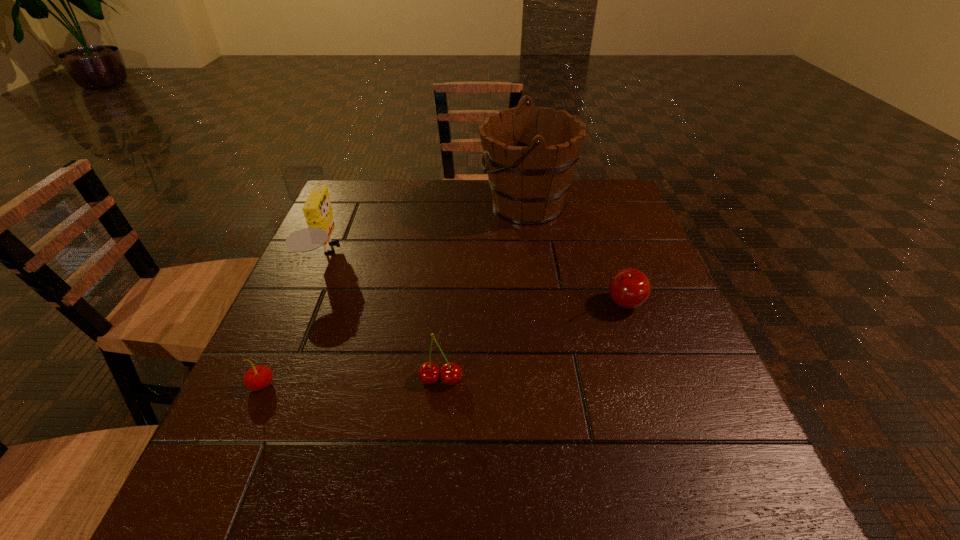
This screenshot has width=960, height=540. I want to click on vacant space situated on the front-facing side of the fourth shortest object, so click(409, 256).

You are a GUI agent. You are given a task and a screenshot of the screen. Output one action in this format:
    pyautogui.click(x=<x>, y=<y>)
    Task: Click on the vacant point located with the stems of the third object from left to right pointing upwards
    
    Given the screenshot: What is the action you would take?
    pyautogui.click(x=438, y=425)

Identify the location of vacant space located 0.400m on the front of the farthest cherry. (700, 524).

Where is `vacant space located on the right of the shortest cherry`? The image size is (960, 540). vacant space located on the right of the shortest cherry is located at coordinates (358, 384).

The width and height of the screenshot is (960, 540). Find the location of `object located at the far edge`. object located at the far edge is located at coordinates (530, 156).

The image size is (960, 540). In order to click on sponge that is at the left edge in this screenshot , I will do `click(317, 210)`.

Locate an element on the screen. cherry that is at the left edge is located at coordinates (257, 378).

Image resolution: width=960 pixels, height=540 pixels. In order to click on wine bucket that is positioned at the right edge in this screenshot , I will do `click(530, 156)`.

Identify the location of cherry that is at the right edge. (629, 288).

Where is `object located in the far right corner section of the desktop`? This screenshot has width=960, height=540. object located in the far right corner section of the desktop is located at coordinates (530, 156).